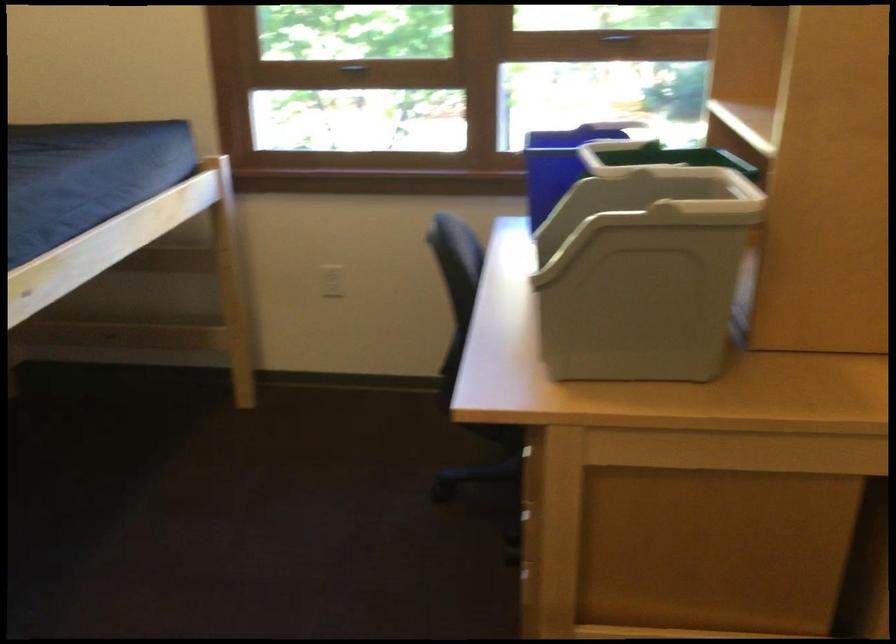
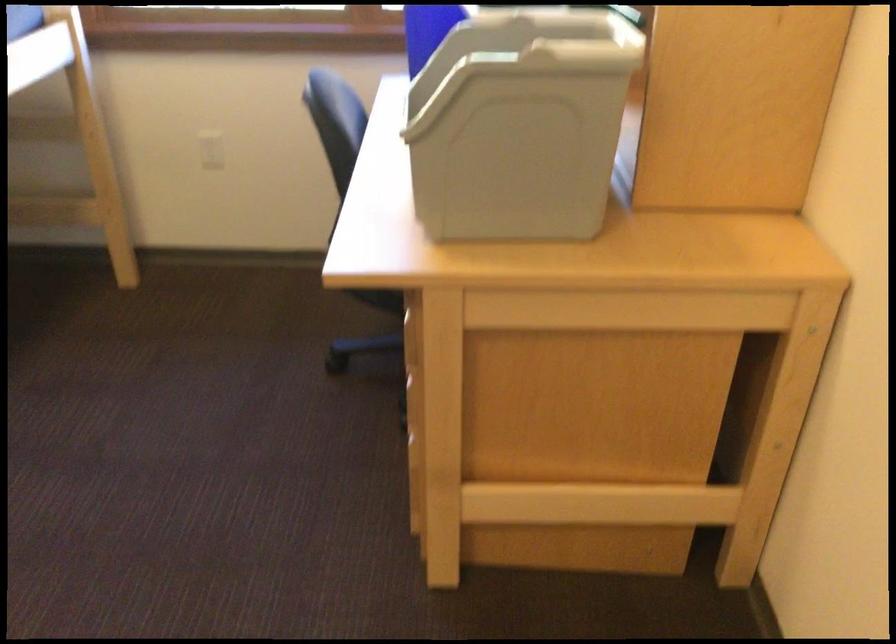
Question: The images are taken continuously from a first-person perspective. In which direction is your viewpoint rotating?

Choices:
 (A) Left
 (B) Right
 (C) Up
 (D) Down

Answer: (D)